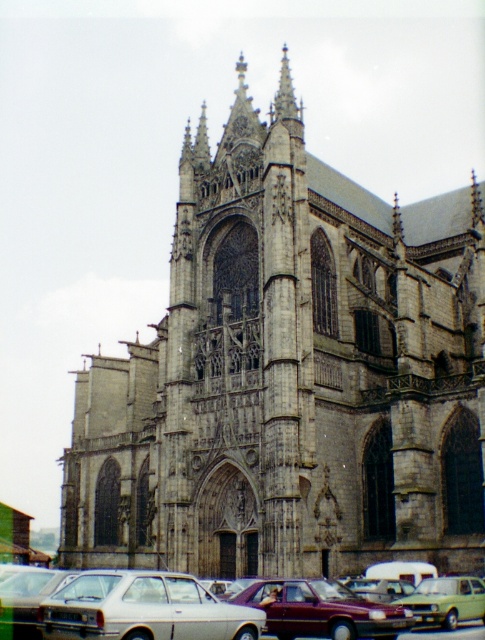
Which of these two, white matte car at lower left or green matte car at lower right, stands shorter?

green matte car at lower right

Does point (81, 634) lie behind point (421, 616)?

No, (81, 634) is in front of (421, 616).

Find the location of a particular element. The image size is (485, 640). white matte car at lower left is located at coordinates (144, 609).

Is maroon metallic car at lower center thinner than green matte car at lower right?

Incorrect, maroon metallic car at lower center's width is not less than green matte car at lower right's.

Does maroon metallic car at lower center appear over green matte car at lower right?

Correct, maroon metallic car at lower center is located above green matte car at lower right.

At what (x,y) coordinates should I click in order to perform the action: click on maroon metallic car at lower center. Please return your answer as a coordinate pair (x, y). Looking at the image, I should click on (321, 611).

Does white glossy sedan at lower center have a greater width compared to green matte car at lower right?

Yes, white glossy sedan at lower center is wider than green matte car at lower right.

Between white glossy sedan at lower center and green matte car at lower right, which one is positioned higher?

green matte car at lower right

Locate an element on the screen. This screenshot has width=485, height=640. white glossy sedan at lower center is located at coordinates (27, 596).

Where is `white glossy sedan at lower center`? Image resolution: width=485 pixels, height=640 pixels. white glossy sedan at lower center is located at coordinates (27, 596).